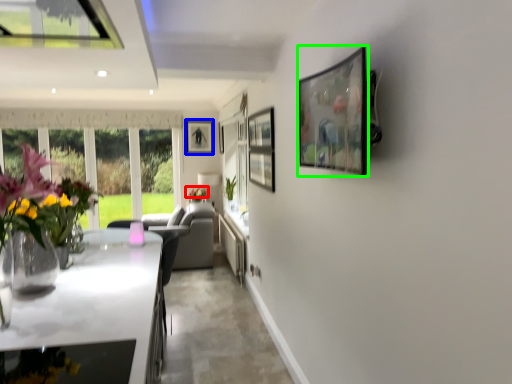
Question: Which object is positioned farthest from flower (highlighted by a red box)? Select from picture frame (highlighted by a blue box) and picture frame (highlighted by a green box).

Choices:
 (A) picture frame
 (B) picture frame

Answer: (B)